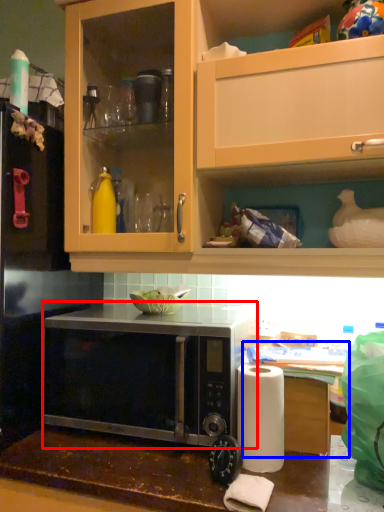
Question: Which object appears farthest to the camera in this image, microwave oven (highlighted by a red box) or table (highlighted by a blue box)?

Choices:
 (A) microwave oven
 (B) table

Answer: (B)